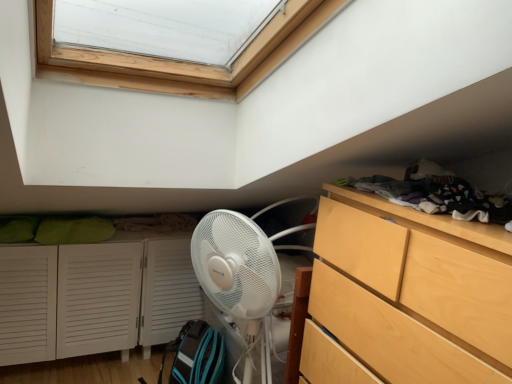
Question: Is dark gray fabric at upper right bigger than light wood/texture chest of drawers at right?

Choices:
 (A) no
 (B) yes

Answer: (A)

Question: Does dark gray fabric at upper right contain light wood/texture chest of drawers at right?

Choices:
 (A) yes
 (B) no

Answer: (B)

Question: Is dark gray fabric at upper right far from light wood/texture chest of drawers at right?

Choices:
 (A) no
 (B) yes

Answer: (A)

Question: Considering the relative sizes of dark gray fabric at upper right and light wood/texture chest of drawers at right in the image provided, is dark gray fabric at upper right taller than light wood/texture chest of drawers at right?

Choices:
 (A) yes
 (B) no

Answer: (B)

Question: Considering the relative sizes of dark gray fabric at upper right and light wood/texture chest of drawers at right in the image provided, is dark gray fabric at upper right smaller than light wood/texture chest of drawers at right?

Choices:
 (A) yes
 (B) no

Answer: (A)

Question: Is dark gray fabric at upper right thinner than light wood/texture chest of drawers at right?

Choices:
 (A) no
 (B) yes

Answer: (B)

Question: From a real-world perspective, is light wood/texture chest of drawers at right located higher than dark gray fabric at upper right?

Choices:
 (A) no
 (B) yes

Answer: (A)

Question: Considering the relative sizes of light wood/texture chest of drawers at right and dark gray fabric at upper right in the image provided, is light wood/texture chest of drawers at right bigger than dark gray fabric at upper right?

Choices:
 (A) yes
 (B) no

Answer: (A)

Question: From a real-world perspective, does light wood/texture chest of drawers at right sit lower than dark gray fabric at upper right?

Choices:
 (A) no
 (B) yes

Answer: (B)

Question: Is light wood/texture chest of drawers at right oriented away from dark gray fabric at upper right?

Choices:
 (A) yes
 (B) no

Answer: (B)

Question: Does light wood/texture chest of drawers at right have a greater height compared to dark gray fabric at upper right?

Choices:
 (A) yes
 (B) no

Answer: (A)

Question: Does light wood/texture chest of drawers at right appear on the left side of dark gray fabric at upper right?

Choices:
 (A) no
 (B) yes

Answer: (B)

Question: Does light wood/texture chest of drawers at right touch white louvered cabinet at lower left?

Choices:
 (A) yes
 (B) no

Answer: (B)